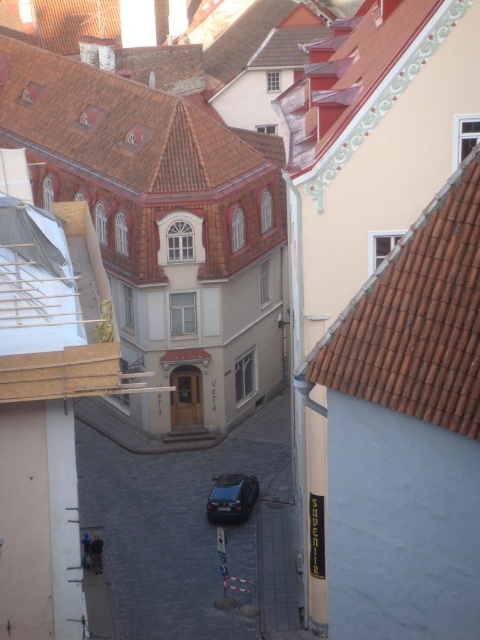
You are a delivery person trying to navigate a narrow street in a historic town. You need to deliver a package to the beige building with a red and white striped awning. The street is so narrow that you must know the width of the roofs to avoid hitting them. Which roof, the brown tile roof at upper right or the brown tiled roof at upper center, is narrower and therefore safer to pass under?

The brown tile roof at upper right is thinner than the brown tiled roof at upper center, so it is narrower and safer to pass under.